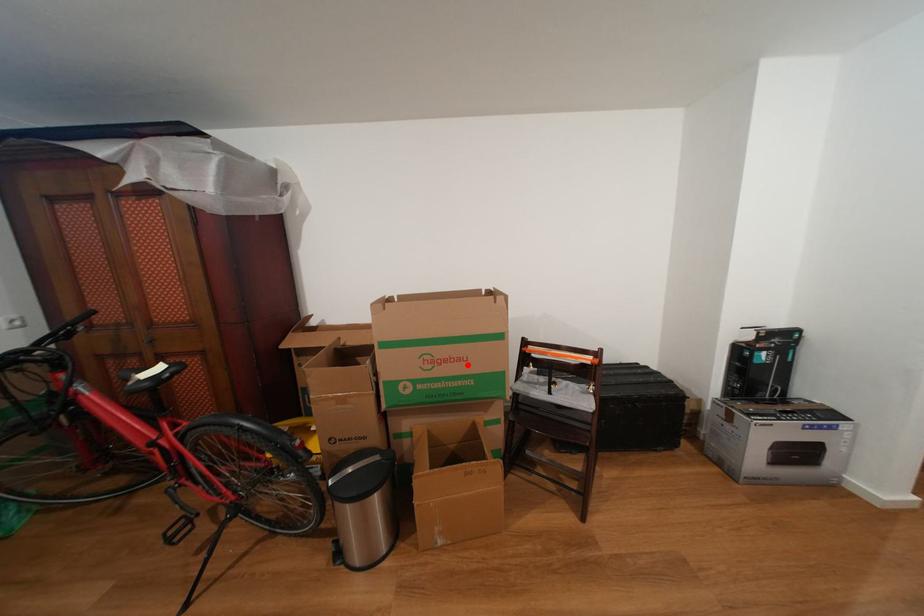
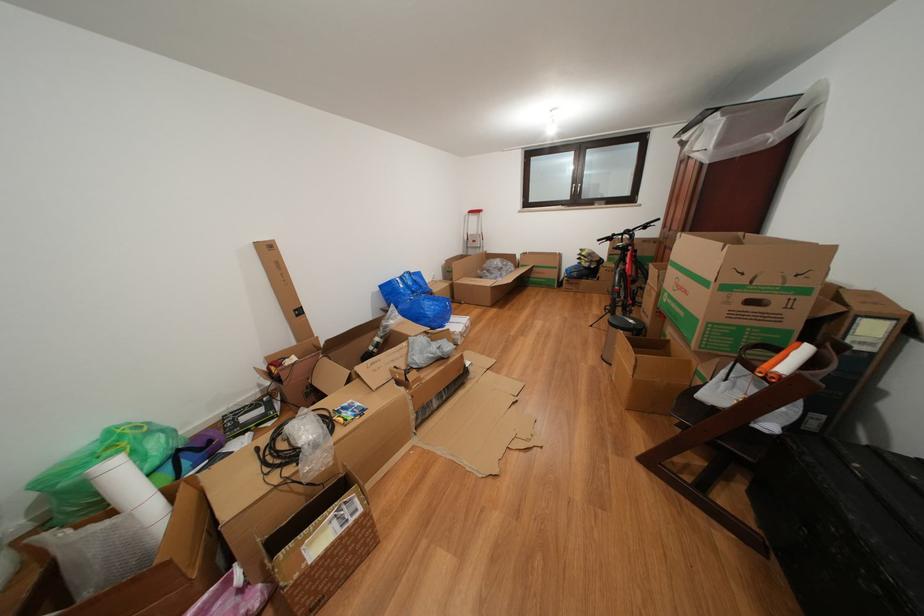
The point at the highlighted location is marked in the first image. Where is the corresponding point in the second image?

(694, 297)